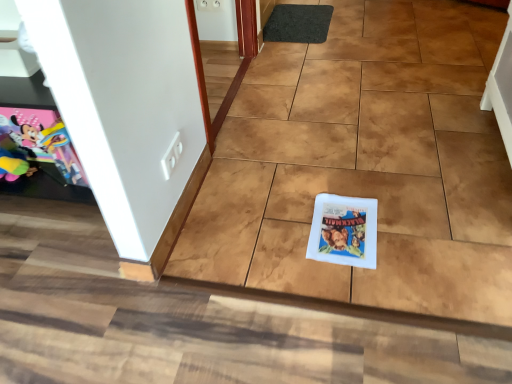
Question: Is black rubber doormat at upper center taller than white paper comic book at center, which is the second comic book from top to bottom?

Choices:
 (A) yes
 (B) no

Answer: (A)

Question: From a real-world perspective, is black rubber doormat at upper center below white paper comic book at center, acting as the second comic book starting from the left?

Choices:
 (A) yes
 (B) no

Answer: (B)

Question: Is the depth of black rubber doormat at upper center greater than that of white paper comic book at center, which is the 1th comic book in right-to-left order?

Choices:
 (A) no
 (B) yes

Answer: (B)

Question: Is there a large distance between black rubber doormat at upper center and white paper comic book at center, which is the 1th comic book in right-to-left order?

Choices:
 (A) no
 (B) yes

Answer: (B)

Question: From the image's perspective, is black rubber doormat at upper center under white paper comic book at center, which is the 1th comic book in right-to-left order?

Choices:
 (A) yes
 (B) no

Answer: (B)

Question: Is white paper comic book at center, which is the second comic book from top to bottom, taller or shorter than matte paper comic book at left, which ranks as the second comic book in bottom-to-top order?

Choices:
 (A) tall
 (B) short

Answer: (B)

Question: Is point (338, 236) positioned closer to the camera than point (42, 124)?

Choices:
 (A) farther
 (B) closer

Answer: (B)

Question: Considering the positions of white paper comic book at center, which is the second comic book from top to bottom, and matte paper comic book at left, the 2th comic book in the right-to-left sequence, in the image, is white paper comic book at center, which is the second comic book from top to bottom, bigger or smaller than matte paper comic book at left, the 2th comic book in the right-to-left sequence,?

Choices:
 (A) small
 (B) big

Answer: (A)

Question: From a real-world perspective, is white paper comic book at center, which is the 1th comic book in right-to-left order, above or below matte paper comic book at left, which appears as the 1th comic book when viewed from the left?

Choices:
 (A) below
 (B) above

Answer: (A)

Question: Do you think matte paper comic book at left, the 2th comic book in the right-to-left sequence, is within black rubber doormat at upper center, or outside of it?

Choices:
 (A) outside
 (B) inside

Answer: (A)

Question: In the image, is matte paper comic book at left, which is the 1th comic book from top to bottom, on the left side or the right side of black rubber doormat at upper center?

Choices:
 (A) left
 (B) right

Answer: (A)

Question: From a real-world perspective, is matte paper comic book at left, which ranks as the second comic book in bottom-to-top order, physically located above or below black rubber doormat at upper center?

Choices:
 (A) above
 (B) below

Answer: (A)

Question: From their relative heights in the image, would you say matte paper comic book at left, the 2th comic book in the right-to-left sequence, is taller or shorter than black rubber doormat at upper center?

Choices:
 (A) short
 (B) tall

Answer: (B)

Question: In the image, is black rubber doormat at upper center positioned in front of or behind matte paper comic book at left, which appears as the 1th comic book when viewed from the left?

Choices:
 (A) behind
 (B) front

Answer: (A)

Question: Is black rubber doormat at upper center spatially inside matte paper comic book at left, which ranks as the second comic book in bottom-to-top order, or outside of it?

Choices:
 (A) inside
 (B) outside

Answer: (B)